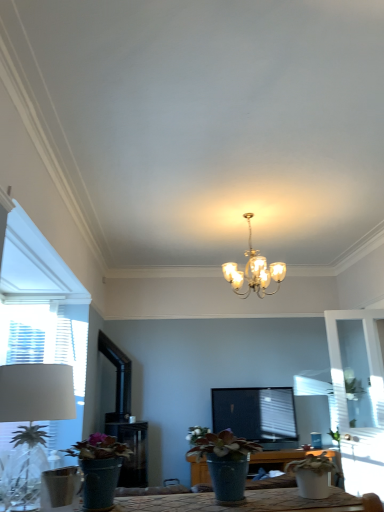
The width and height of the screenshot is (384, 512). What are the coordinates of `matte blue pot at center, the 2th houseplant positioned from the left` in the screenshot? It's located at (225, 463).

This screenshot has width=384, height=512. Identify the location of white matte flower at center. (196, 433).

The image size is (384, 512). What do you see at coordinates (99, 469) in the screenshot?
I see `matte green pot at lower left, which is the first houseplant from left to right` at bounding box center [99, 469].

What are the coordinates of `white fabric lampshade at left` in the screenshot? It's located at (32, 423).

This screenshot has height=512, width=384. I want to click on gold metallic chandelier at center, so click(254, 271).

In the scene shown: Is white fabric lampshade at left placed right next to white matte flower at center?

white fabric lampshade at left and white matte flower at center are not in contact.

This screenshot has height=512, width=384. I want to click on flower on the right of white fabric lampshade at left, so point(196,433).

Would you say white fabric lampshade at left is inside or outside white matte flower at center?

white fabric lampshade at left is not inside white matte flower at center, it's outside.

Is white fabric lampshade at left facing towards white matte flower at center?

No.

Is point (193, 436) less distant than point (2, 409)?

That is False.

From a real-world perspective, is white matte flower at center located higher than white fabric lampshade at left?

Actually, white matte flower at center is physically below white fabric lampshade at left in the real world.

Can you see white matte flower at center touching white fabric lampshade at left?

No, white matte flower at center is not making contact with white fabric lampshade at left.

In the image, is white matte flower at center on the left side or the right side of white fabric lampshade at left?

From the image, it's evident that white matte flower at center is to the right of white fabric lampshade at left.

Is white matte pot at lower right, which is the 3th houseplant in left-to-right order, completely or partially outside of white fabric lampshade at left?

Yes, white matte pot at lower right, which is the 3th houseplant in left-to-right order, is outside of white fabric lampshade at left.

From the picture: Can you tell me how much white matte pot at lower right, which is the 1th houseplant in right-to-left order, and white fabric lampshade at left differ in facing direction?

A: 0.018 degrees.

Is white matte pot at lower right, which is the 3th houseplant in left-to-right order, to the left of white fabric lampshade at left from the viewer's perspective?

In fact, white matte pot at lower right, which is the 3th houseplant in left-to-right order, is to the right of white fabric lampshade at left.

In the scene shown: Is white matte pot at lower right, which is the 1th houseplant in right-to-left order, touching white fabric lampshade at left?

No.

From the image's perspective, is transparent glass door at right located above or below gold metallic chandelier at center?

transparent glass door at right is situated lower than gold metallic chandelier at center in the image.

Looking at this image, between transparent glass door at right and gold metallic chandelier at center, which one has smaller size?

Smaller between the two is transparent glass door at right.

Does transparent glass door at right have a lesser height compared to gold metallic chandelier at center?

No.

Does point (370, 316) appear closer or farther from the camera than point (231, 272)?

Point (370, 316).

Does gold metallic chandelier at center have a larger size compared to white matte pot at lower right, which is the 1th houseplant in right-to-left order?

Yes.

Is gold metallic chandelier at center at the right side of white matte pot at lower right, which is the 3th houseplant in left-to-right order?

Yes, gold metallic chandelier at center is to the right of white matte pot at lower right, which is the 3th houseplant in left-to-right order.

Considering the points (252, 267) and (300, 490), which point is behind, point (252, 267) or point (300, 490)?

The point (252, 267) is behind.

From the image's perspective, would you say gold metallic chandelier at center is shown under white matte pot at lower right, which is the 3th houseplant in left-to-right order?

No.

Starting from the white matte pot at lower right, which is the 1th houseplant in right-to-left order, which houseplant is the 2nd one to the left? Please provide its 2D coordinates.

[(99, 469)]

How distant is matte green pot at lower left, which is the first houseplant from left to right, from white matte pot at lower right, which is the 1th houseplant in right-to-left order?

A distance of 33.02 inches exists between matte green pot at lower left, which is the first houseplant from left to right, and white matte pot at lower right, which is the 1th houseplant in right-to-left order.

Which of these two, matte green pot at lower left, placed as the third houseplant when sorted from right to left, or white matte pot at lower right, which is the 1th houseplant in right-to-left order, is wider?

matte green pot at lower left, placed as the third houseplant when sorted from right to left, is wider.

Does matte green pot at lower left, which is the first houseplant from left to right, appear on the right side of white matte pot at lower right, which is the 1th houseplant in right-to-left order?

Incorrect, matte green pot at lower left, which is the first houseplant from left to right, is not on the right side of white matte pot at lower right, which is the 1th houseplant in right-to-left order.

In the scene shown: Which object is positioned more to the left, gold metallic chandelier at center or matte blue pot at center, which is counted as the second houseplant, starting from the right?

Positioned to the left is matte blue pot at center, which is counted as the second houseplant, starting from the right.

Is gold metallic chandelier at center taller or shorter than matte blue pot at center, which is counted as the second houseplant, starting from the right?

Considering their sizes, gold metallic chandelier at center has more height than matte blue pot at center, which is counted as the second houseplant, starting from the right.

Considering the sizes of objects gold metallic chandelier at center and matte blue pot at center, which is counted as the second houseplant, starting from the right, in the image provided, who is thinner, gold metallic chandelier at center or matte blue pot at center, which is counted as the second houseplant, starting from the right,?

Thinner between the two is matte blue pot at center, which is counted as the second houseplant, starting from the right.

Is gold metallic chandelier at center positioned in front of matte blue pot at center, the 2th houseplant positioned from the left?

No, gold metallic chandelier at center is further to the viewer.

This screenshot has width=384, height=512. I want to click on table lamp that appears above the white matte flower at center (from the image's perspective), so click(x=32, y=423).

This screenshot has height=512, width=384. Identify the location of table lamp on the left of white matte flower at center. (32, 423).

Estimate the real-world distances between objects in this image. Which object is closer to white matte flower at center, transparent glass door at right or white matte pot at lower right, which is the 3th houseplant in left-to-right order?

white matte pot at lower right, which is the 3th houseplant in left-to-right order, is closer to white matte flower at center.

Estimate the real-world distances between objects in this image. Which object is closer to white fabric lampshade at left, matte green pot at lower left, placed as the third houseplant when sorted from right to left, or transparent glass door at right?

matte green pot at lower left, placed as the third houseplant when sorted from right to left, is positioned closer to the anchor white fabric lampshade at left.

Which object lies further to the anchor point gold metallic chandelier at center, transparent glass door at right or matte blue pot at center, the 2th houseplant positioned from the left?

matte blue pot at center, the 2th houseplant positioned from the left, is positioned further to the anchor gold metallic chandelier at center.

Looking at the image, which one is located further to matte green pot at lower left, which is the first houseplant from left to right, white matte pot at lower right, which is the 1th houseplant in right-to-left order, or transparent glass door at right?

transparent glass door at right is positioned further to the anchor matte green pot at lower left, which is the first houseplant from left to right.

Considering their positions, is white fabric lampshade at left positioned closer to matte blue pot at center, the 2th houseplant positioned from the left, than white matte flower at center?

The object closer to matte blue pot at center, the 2th houseplant positioned from the left, is white matte flower at center.

Considering their positions, is matte blue pot at center, which is counted as the second houseplant, starting from the right, positioned further to matte green pot at lower left, placed as the third houseplant when sorted from right to left, than gold metallic chandelier at center?

gold metallic chandelier at center lies further to matte green pot at lower left, placed as the third houseplant when sorted from right to left, than the other object.

Looking at the image, which one is located further to white matte pot at lower right, which is the 1th houseplant in right-to-left order, white fabric lampshade at left or white matte flower at center?

Among the two, white fabric lampshade at left is located further to white matte pot at lower right, which is the 1th houseplant in right-to-left order.

Based on their spatial positions, is white fabric lampshade at left or transparent glass door at right closer to white matte flower at center?

white fabric lampshade at left is positioned closer to the anchor white matte flower at center.

Locate an element on the screen. The image size is (384, 512). houseplant between matte green pot at lower left, placed as the third houseplant when sorted from right to left, and transparent glass door at right in the front-back direction is located at coordinates (312, 475).

Image resolution: width=384 pixels, height=512 pixels. What are the coordinates of `houseplant located between matte green pot at lower left, which is the first houseplant from left to right, and white matte pot at lower right, which is the 1th houseplant in right-to-left order, in the left-right direction` in the screenshot? It's located at (225, 463).

I want to click on glass door between matte blue pot at center, which is counted as the second houseplant, starting from the right, and white matte flower at center from front to back, so click(x=347, y=407).

Locate an element on the screen. This screenshot has width=384, height=512. houseplant between matte green pot at lower left, which is the first houseplant from left to right, and white matte flower at center from front to back is located at coordinates (312, 475).